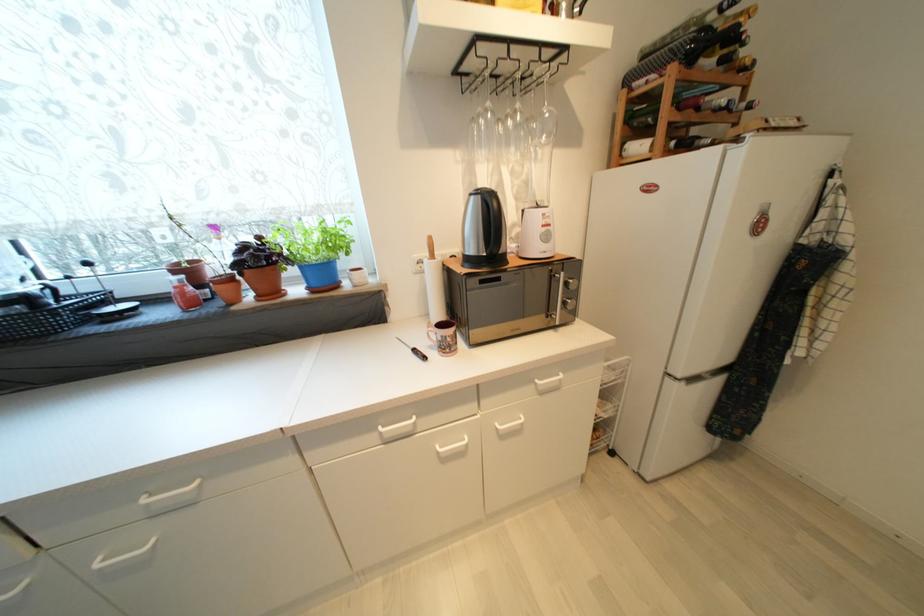
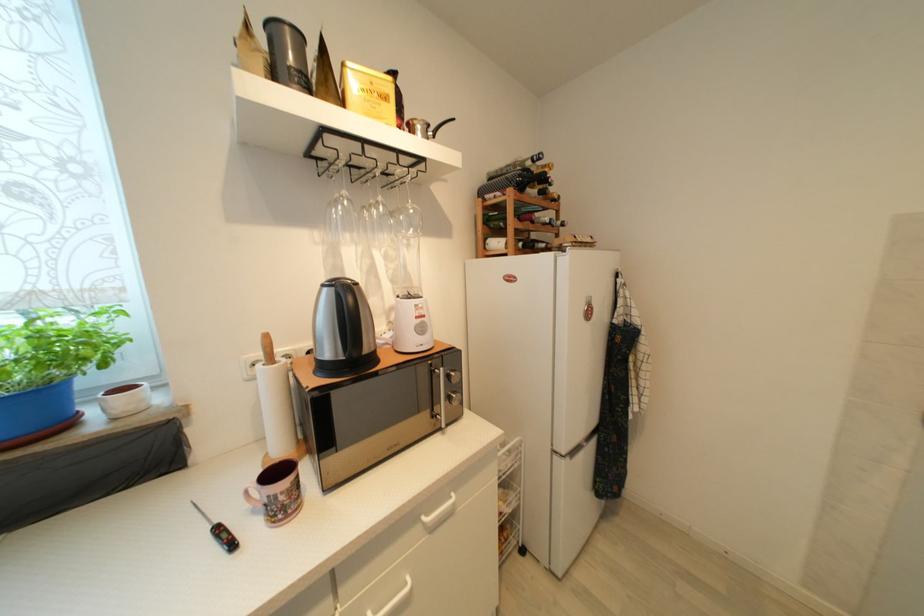
Question: The camera is either moving clockwise (left) or counter-clockwise (right) around the object. The first image is from the beginning of the video and the second image is from the end. Is the camera moving left or right when shooting the video?

Choices:
 (A) Left
 (B) Right

Answer: (A)